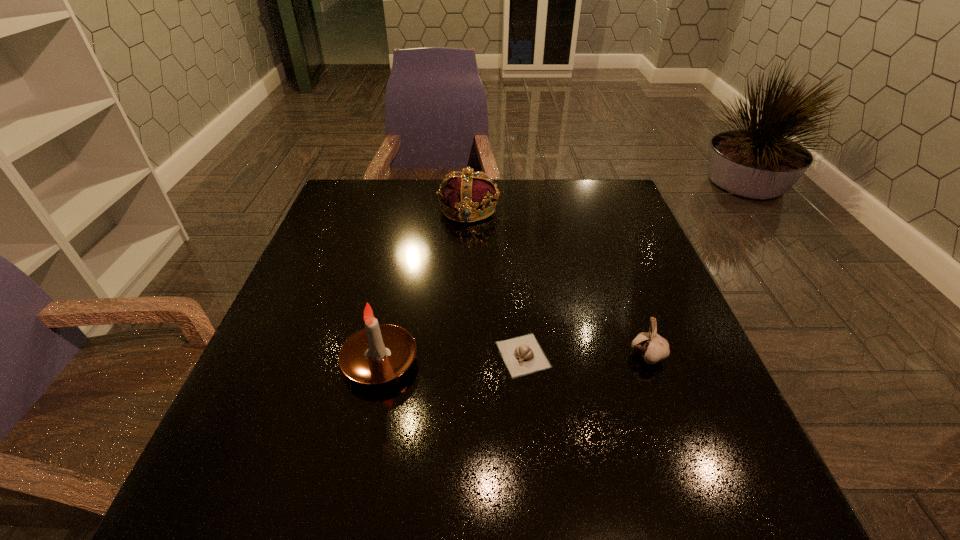
Find the location of a particular element. This screenshot has width=960, height=540. vacant region located on the back of the shortest object is located at coordinates (512, 235).

The image size is (960, 540). Identify the location of object that is at the far edge. (468, 195).

Find the location of `object that is positioned at the right edge`. object that is positioned at the right edge is located at coordinates (653, 348).

Where is `free space at the far edge of the desktop`? free space at the far edge of the desktop is located at coordinates (399, 214).

Where is `vacant space at the near edge of the desktop`? Image resolution: width=960 pixels, height=540 pixels. vacant space at the near edge of the desktop is located at coordinates (302, 522).

In order to click on blank space at the left edge in this screenshot , I will do `click(284, 408)`.

I want to click on free space at the right edge of the desktop, so click(662, 446).

This screenshot has height=540, width=960. Identify the location of free region at the near left corner. (280, 496).

Where is `blank space at the far right corner`? The image size is (960, 540). blank space at the far right corner is located at coordinates (616, 184).

Image resolution: width=960 pixels, height=540 pixels. Identify the location of empty space between the candle and the crown. (424, 285).